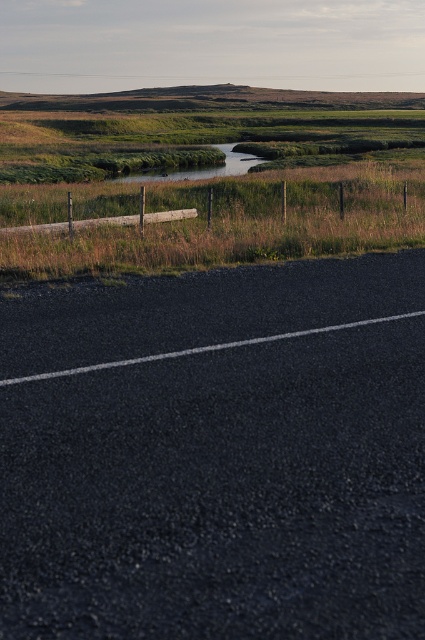
Question: Which object appears farthest from the camera in this image?

Choices:
 (A) black asphalt highway at lower center
 (B) green grass at upper center

Answer: (B)

Question: Does green grass at upper center come behind green grassy creek at center?

Choices:
 (A) yes
 (B) no

Answer: (B)

Question: Which of the following is the closest to the observer?

Choices:
 (A) black asphalt highway at lower center
 (B) green grass at upper center
 (C) green grassy creek at center

Answer: (A)

Question: Which object appears closest to the camera in this image?

Choices:
 (A) black asphalt highway at lower center
 (B) green grass at upper center

Answer: (A)

Question: Does black asphalt highway at lower center appear under green grass at upper center?

Choices:
 (A) no
 (B) yes

Answer: (B)

Question: Is black asphalt highway at lower center bigger than green grass at upper center?

Choices:
 (A) no
 (B) yes

Answer: (A)